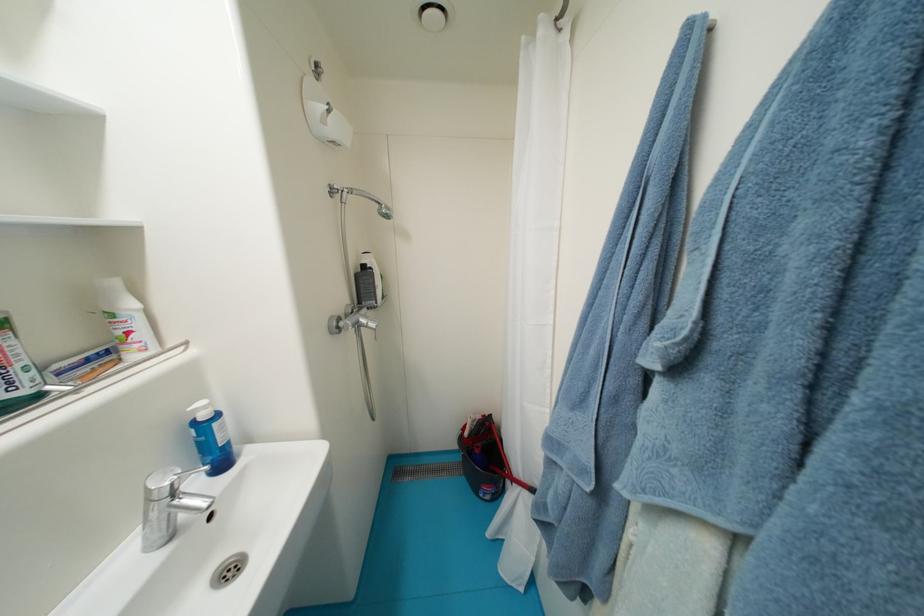
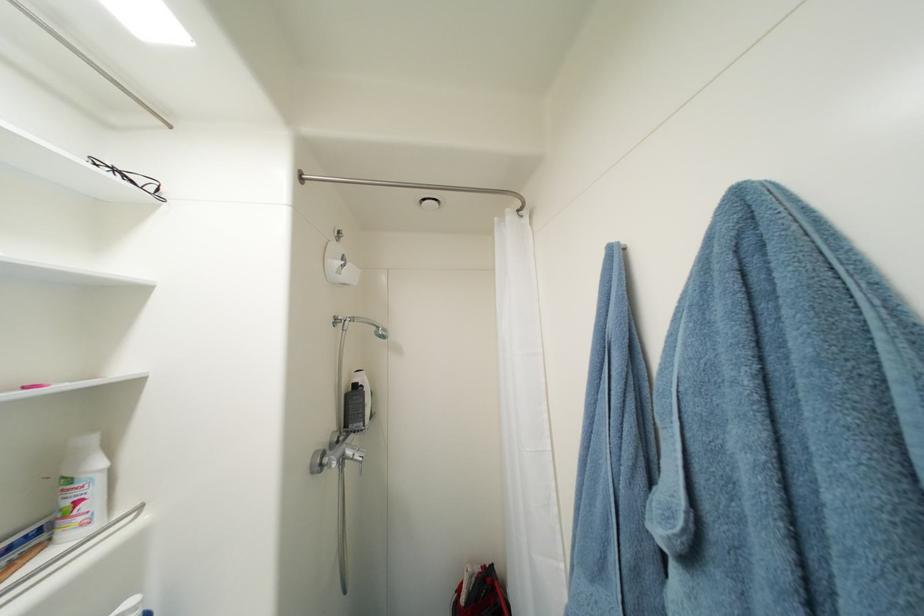
In the second image, find the point that corresponds to [136,334] in the first image.

(84, 504)